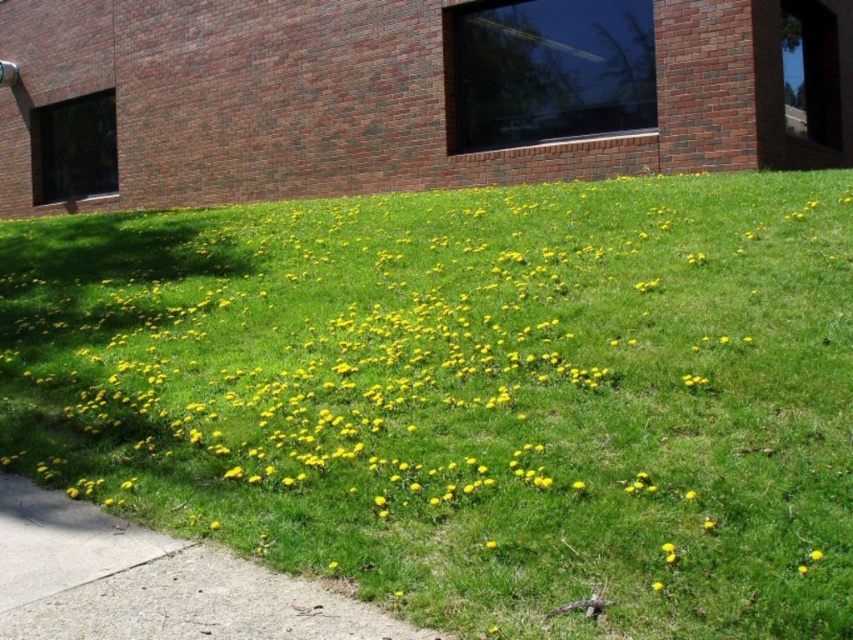
At what (x,y) coordinates should I click in order to perform the action: click on gray concrete sidewalk at lower left. Please return your answer as a coordinate pair (x, y). The width and height of the screenshot is (853, 640). Looking at the image, I should click on (154, 582).

Can you confirm if gray concrete sidewalk at lower left is positioned to the left of yellow soft dandelion at center?

Yes, gray concrete sidewalk at lower left is to the left of yellow soft dandelion at center.

Locate an element on the screen. gray concrete sidewalk at lower left is located at coordinates (154, 582).

Who is positioned more to the left, green grass at center or yellow matte flower at center?

From the viewer's perspective, green grass at center appears more on the left side.

Is green grass at center below yellow matte flower at center?

No, green grass at center is not below yellow matte flower at center.

Who is more distant from viewer, (207, 259) or (807, 570)?

The point (207, 259) is behind.

Where is `green grass at center`? The image size is (853, 640). green grass at center is located at coordinates (467, 394).

Is point (165, 560) positioned behind point (799, 573)?

That is True.

You are a GUI agent. You are given a task and a screenshot of the screen. Output one action in this format:
    pyautogui.click(x=<x>, y=<y>)
    Task: Click on the gray concrete sidewalk at lower left
    
    Given the screenshot: What is the action you would take?
    pyautogui.click(x=154, y=582)

Locate an element on the screen. Image resolution: width=853 pixels, height=640 pixels. gray concrete sidewalk at lower left is located at coordinates 154,582.